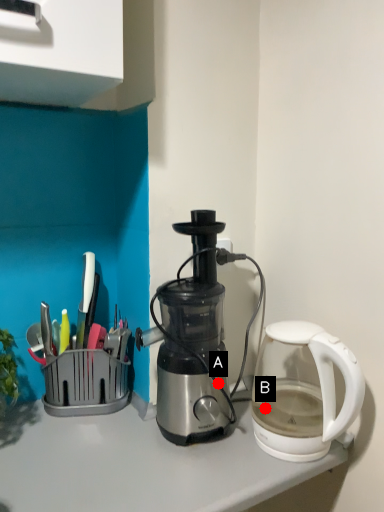
Question: Two points are circled on the image, labeled by A and B beside each circle. Which point is closer to the camera taking this photo?

Choices:
 (A) A is closer
 (B) B is closer

Answer: (B)